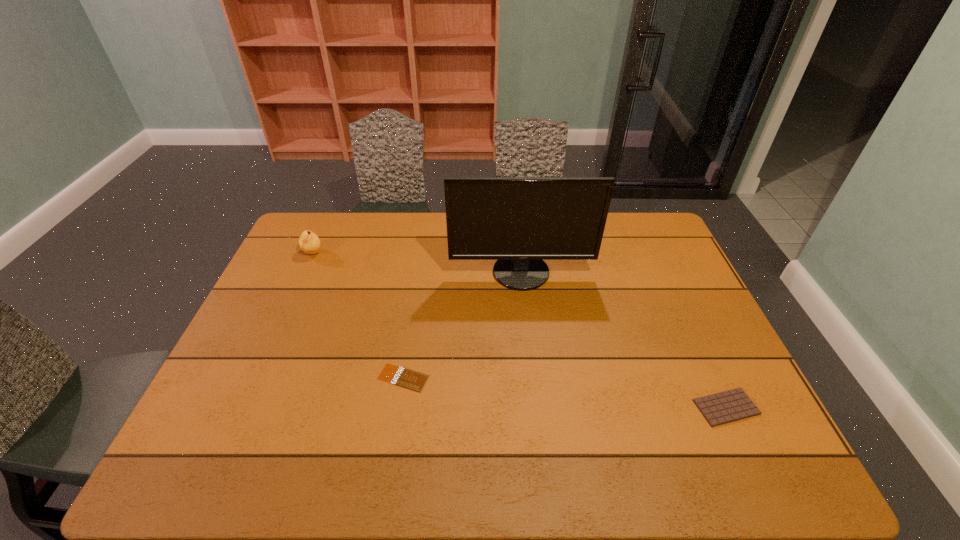
This screenshot has height=540, width=960. I want to click on vacant area located on the back of the taller chocolate bar, so click(698, 348).

At what (x,y) coordinates should I click in order to perform the action: click on vacant region located 0.180m on the left of the left chocolate bar. Please return your answer as a coordinate pair (x, y). Looking at the image, I should click on (307, 377).

I want to click on object located in the far edge section of the desktop, so click(x=309, y=242).

I want to click on object that is at the left edge, so click(x=309, y=242).

The width and height of the screenshot is (960, 540). Identify the location of object that is positioned at the right edge. (732, 405).

I want to click on object located in the far left corner section of the desktop, so click(x=309, y=242).

Image resolution: width=960 pixels, height=540 pixels. Identify the location of vacant space at the far edge of the desktop. (419, 245).

Where is `vacant space at the near edge of the desktop`? The height and width of the screenshot is (540, 960). vacant space at the near edge of the desktop is located at coordinates (373, 474).

Locate an element on the screen. The width and height of the screenshot is (960, 540). vacant space at the left edge of the desktop is located at coordinates (284, 260).

Where is `vacant space at the right edge`? This screenshot has width=960, height=540. vacant space at the right edge is located at coordinates (666, 328).